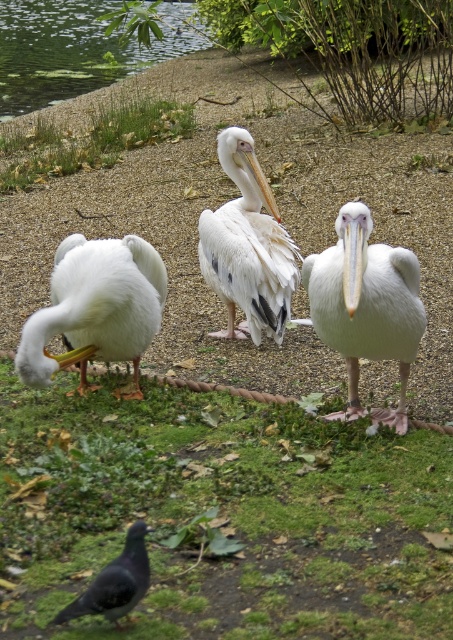
Question: Can you confirm if white matte pelican at lower left is wider than white feathered pelican at center?

Choices:
 (A) no
 (B) yes

Answer: (A)

Question: Which object is closer to the camera taking this photo?

Choices:
 (A) white matte pelican at center
 (B) orange beak at center
 (C) green grass at upper left
 (D) green algae water at upper left

Answer: (A)

Question: Estimate the real-world distances between objects in this image. Which object is farther from the gray matte pigeon at lower left?

Choices:
 (A) green algae water at upper left
 (B) green grass at lower left
 (C) orange beak at center

Answer: (A)

Question: Does white matte pelican at lower left appear on the left side of orange beak at center?

Choices:
 (A) yes
 (B) no

Answer: (A)

Question: Which point appears closest to the camera in this image?

Choices:
 (A) (173, 140)
 (B) (361, 266)
 (C) (115, 340)

Answer: (B)

Question: Can you confirm if white feathered pelican at center is wider than orange beak at center?

Choices:
 (A) yes
 (B) no

Answer: (A)